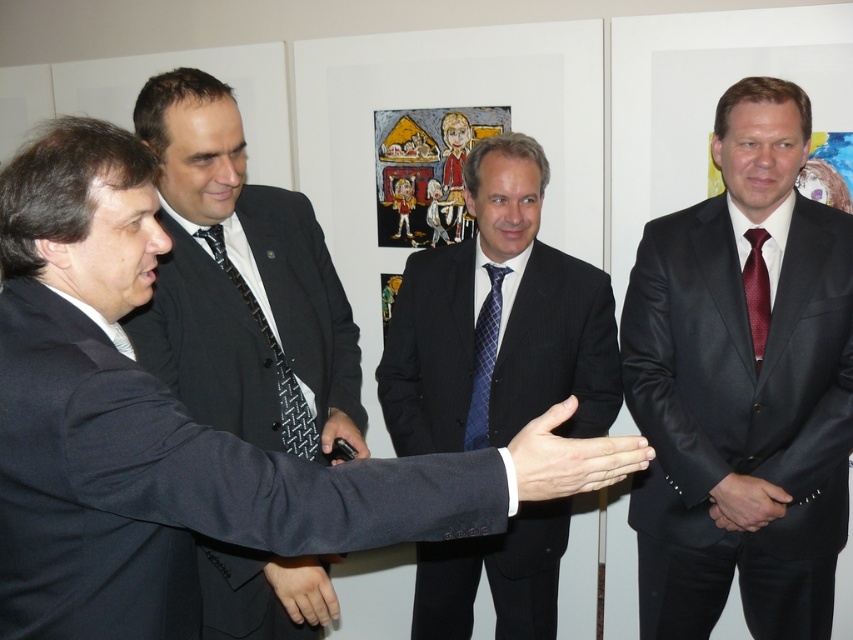
Question: Estimate the real-world distances between objects in this image. Which object is closer to the smooth skin hand at center?

Choices:
 (A) black textured suit at left
 (B) maroon dotted tie at right
 (C) pinstriped suit at center

Answer: (A)

Question: Does dark gray suit at center have a greater width compared to blue textured tie at center?

Choices:
 (A) yes
 (B) no

Answer: (A)

Question: Among these points, which one is nearest to the camera?

Choices:
 (A) (306, 593)
 (B) (755, 589)
 (C) (476, 348)
 (D) (149, 364)

Answer: (A)

Question: Can you confirm if white matte hand at center is wider than smooth skin hand at center?

Choices:
 (A) yes
 (B) no

Answer: (A)

Question: Observing the image, what is the correct spatial positioning of smooth skin hand at center in reference to maroon dotted tie at right?

Choices:
 (A) right
 (B) left

Answer: (B)

Question: Which object appears closest to the camera in this image?

Choices:
 (A) pinstriped suit at center
 (B) maroon dotted tie at right
 (C) blue textured tie at center
 (D) smooth skin hand at center

Answer: (D)